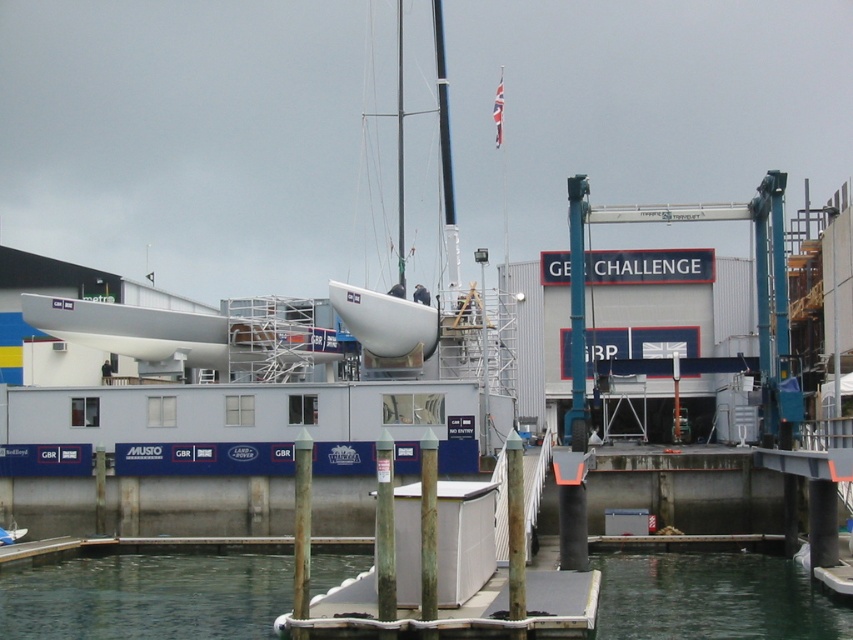
Looking at this image, you are a sailor standing at the edge of the dock. You see the point at coordinates (x=146, y=595). What is located at that point?

The point at coordinates (x=146, y=595) corresponds to clear water at dock center.

You are a dock worker who needs to ensure the white matte boat at center can fit through a narrow channel that is only as wide as the clear water at dock center. Based on the scene, will the boat fit through the channel?

The clear water at dock center is wider than the white matte boat at center. Since the channel is as wide as the clear water at dock center, the boat should fit through the channel.

You are a dock worker standing at the edge of the dock. You need to move a tool from the clear water at dock center to the white matte boat at center. Which direction should you move the tool to place it on the boat?

The clear water at dock center is positioned on the right side of white matte boat at center, so you should move the tool to the left to place it on the white matte boat at center.